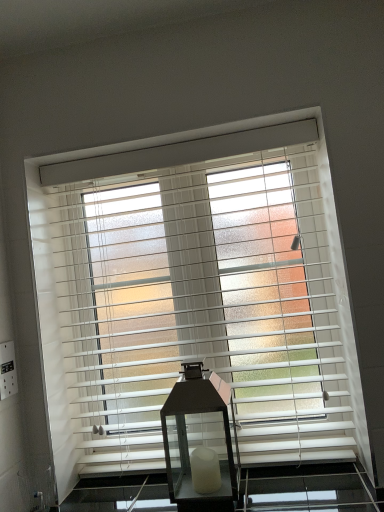
Question: From the image's perspective, is matte black lantern at center above or below white matte blinds at center?

Choices:
 (A) above
 (B) below

Answer: (B)

Question: Does point (195, 494) appear closer or farther from the camera than point (284, 318)?

Choices:
 (A) farther
 (B) closer

Answer: (B)

Question: In terms of width, does matte black lantern at center look wider or thinner when compared to white matte blinds at center?

Choices:
 (A) wide
 (B) thin

Answer: (A)

Question: Is white matte blinds at center inside the boundaries of matte black lantern at center, or outside?

Choices:
 (A) inside
 (B) outside

Answer: (B)

Question: From the image's perspective, is white matte blinds at center above or below matte black lantern at center?

Choices:
 (A) above
 (B) below

Answer: (A)

Question: Is white matte blinds at center wider or thinner than matte black lantern at center?

Choices:
 (A) wide
 (B) thin

Answer: (B)

Question: From a real-world perspective, relative to matte black lantern at center, is white matte blinds at center vertically above or below?

Choices:
 (A) below
 (B) above

Answer: (B)